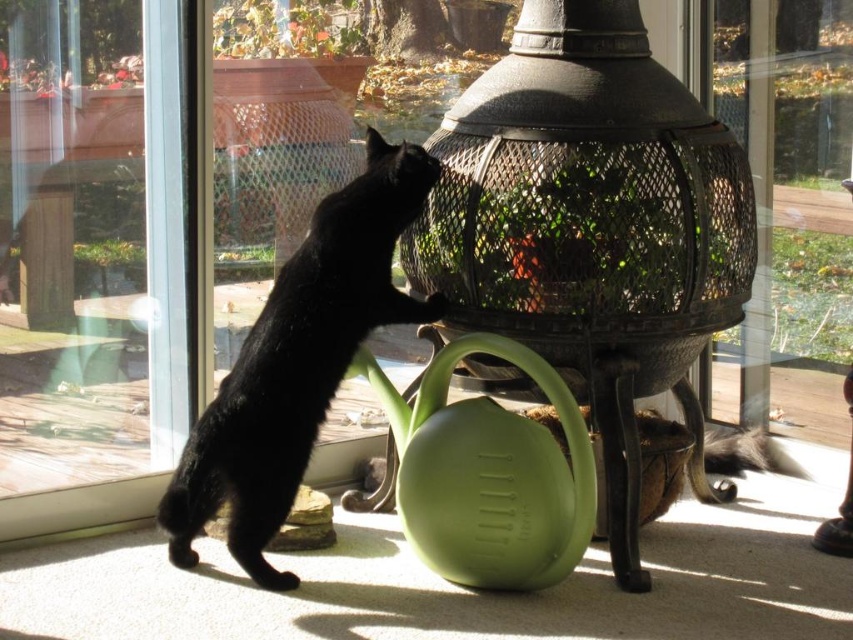
In the scene shown: Can you confirm if metallic wire birdcage at center is shorter than transparent glass screen door at left?

No.

Identify the location of metallic wire birdcage at center. (590, 228).

Consider the image. Which is above, metallic wire birdcage at center or black glossy fur cat at left?

metallic wire birdcage at center is higher up.

Between metallic wire birdcage at center and black glossy fur cat at left, which one appears on the left side from the viewer's perspective?

black glossy fur cat at left

Locate an element on the screen. This screenshot has width=853, height=640. metallic wire birdcage at center is located at coordinates (590, 228).

Who is taller, transparent glass screen door at left or black glossy fur cat at left?

With more height is transparent glass screen door at left.

Can you confirm if transparent glass screen door at left is positioned below black glossy fur cat at left?

Actually, transparent glass screen door at left is above black glossy fur cat at left.

Locate an element on the screen. This screenshot has width=853, height=640. transparent glass screen door at left is located at coordinates (91, 260).